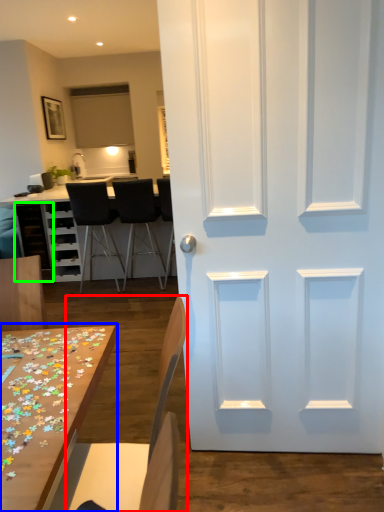
Question: Which object is positioned closest to chair (highlighted by a red box)? Select from table (highlighted by a blue box) and cabinetry (highlighted by a green box).

Choices:
 (A) table
 (B) cabinetry

Answer: (A)